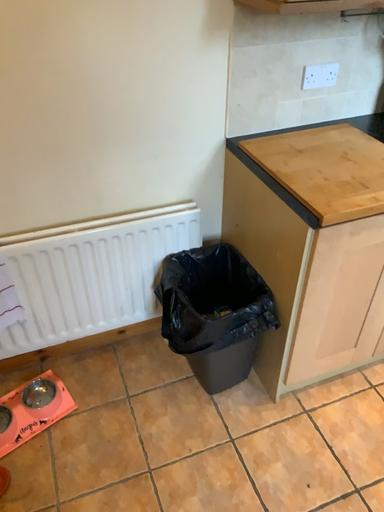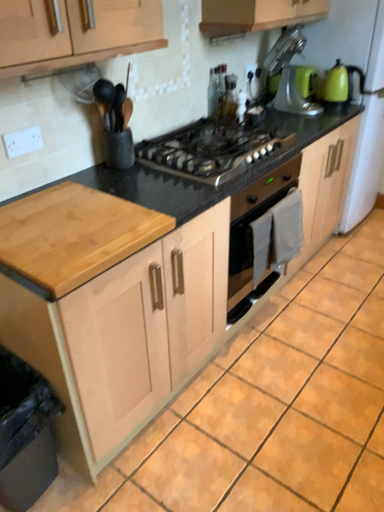
Question: How did the camera likely rotate when shooting the video?

Choices:
 (A) rotated upward
 (B) rotated downward

Answer: (A)